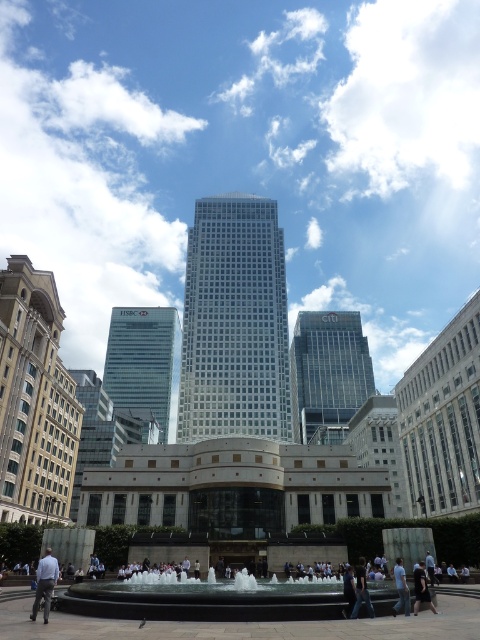
You are a tourist standing in the plaza looking towards the skyscrapers. You see the reflective glass fountain at center and the transparent glass skyscraper at center. Which object is positioned to the right of the other?

The reflective glass fountain at center is to the right of the transparent glass skyscraper at center.

You are standing at the center of the plaza and want to take a photo of the white glass skyscraper at center. Which direction should you face to ensure the skyscraper is in the center of your camera frame?

Since the white glass skyscraper at center is located at coordinates approximately 0.503 on the x and 0.490 on the y axis, which is nearly the center point of the image, you should face directly ahead to have the skyscraper centered in your camera frame.

You are standing at the entrance of the HSBC building and want to reach the reflective glass fountain at center. According to the coordinates provided, in which direction should you head to reach the fountain?

The reflective glass fountain at center is located at point [204,602]. Since you are at the HSBC building entrance, which is part of the cluster of high rises including the skyscraper at center, you should head towards the center of the plaza to reach the fountain.